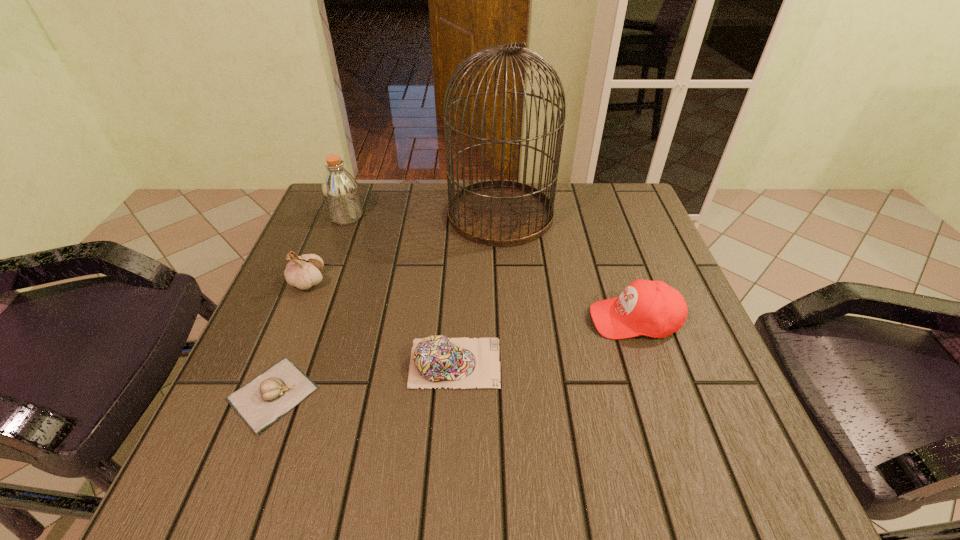
What are the coordinates of `bottle positioned at the left edge` in the screenshot? It's located at (340, 190).

Where is `object present at the right edge`? object present at the right edge is located at coordinates (652, 308).

The image size is (960, 540). Identify the location of object present at the far left corner. (340, 190).

Find the location of a particular element. object that is at the near left corner is located at coordinates coord(261,402).

Find the location of a particular element. This screenshot has width=960, height=540. free space at the far edge is located at coordinates (575, 199).

This screenshot has height=540, width=960. What are the coordinates of `blank area at the left edge` in the screenshot? It's located at (293, 346).

At what (x,y) coordinates should I click in order to perform the action: click on vacant space at the right edge of the desktop. Please return your answer as a coordinate pair (x, y). This screenshot has height=540, width=960. Looking at the image, I should click on (715, 387).

In the image, there is a desktop. Find the location of `vacant space at the near left corner`. vacant space at the near left corner is located at coordinates (252, 475).

The height and width of the screenshot is (540, 960). Identify the location of vacant position at the far right corner of the desktop. (588, 210).

Identify the location of vacant point located between the cap and the nearer garlic. Image resolution: width=960 pixels, height=540 pixels. (364, 378).